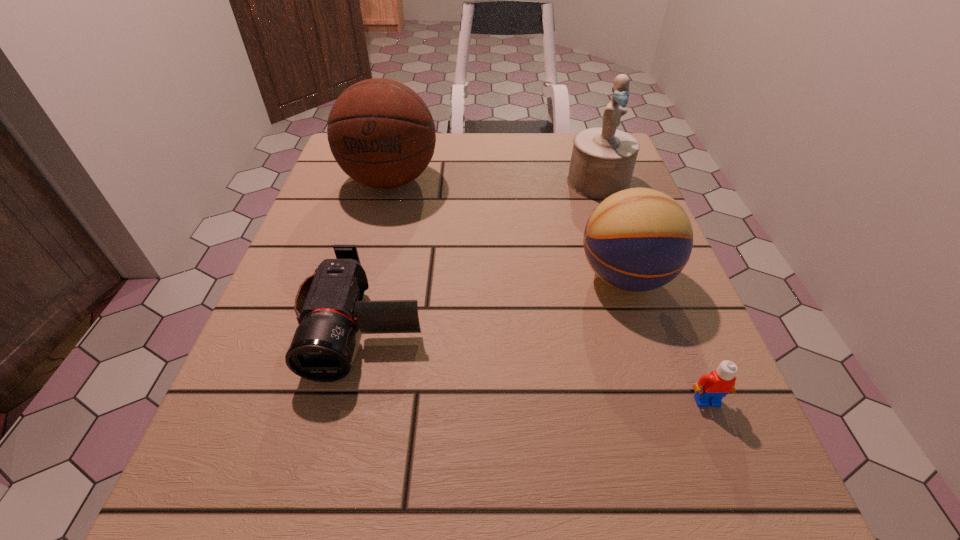
Locate an element on the screen. Lego at the right edge is located at coordinates (711, 388).

The height and width of the screenshot is (540, 960). Identify the location of object positioned at the far left corner. (381, 133).

At what (x,y) coordinates should I click in order to perform the action: click on object at the far right corner. Please return your answer as a coordinate pair (x, y). The height and width of the screenshot is (540, 960). Looking at the image, I should click on (603, 158).

Locate an element on the screen. Image resolution: width=960 pixels, height=540 pixels. free region at the far edge of the desktop is located at coordinates (447, 181).

I want to click on vacant space at the near edge of the desktop, so click(x=465, y=507).

In the image, there is a desktop. Identify the location of blank space at the left edge. pos(354,212).

This screenshot has height=540, width=960. Find the location of `free spot at the right edge of the desktop`. free spot at the right edge of the desktop is located at coordinates (616, 355).

Identify the location of vacant space that is in between the shorter basketball and the camcorder. Image resolution: width=960 pixels, height=540 pixels. (494, 300).

This screenshot has height=540, width=960. In order to click on vacant space in between the nearest object and the left basketball in this screenshot , I will do `click(548, 291)`.

Locate an element on the screen. This screenshot has width=960, height=540. unoccupied position between the camcorder and the Lego is located at coordinates (536, 362).